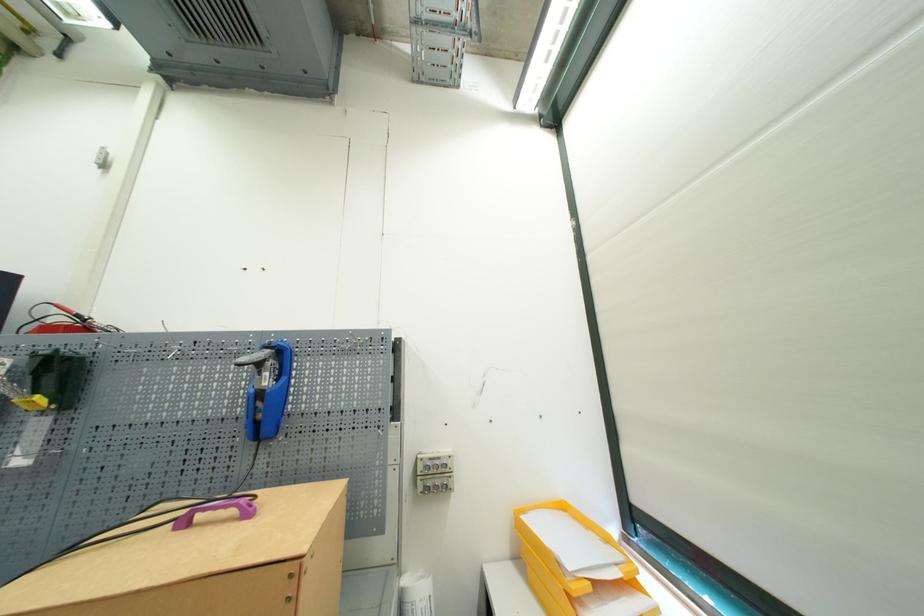
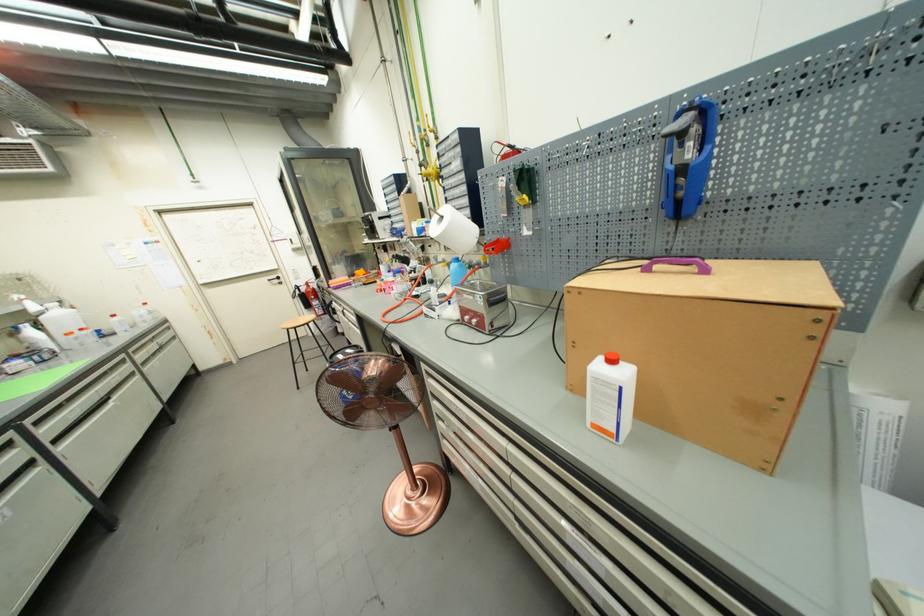
Where in the second image is the point corresponding to point (266, 379) from the first image?

(689, 152)